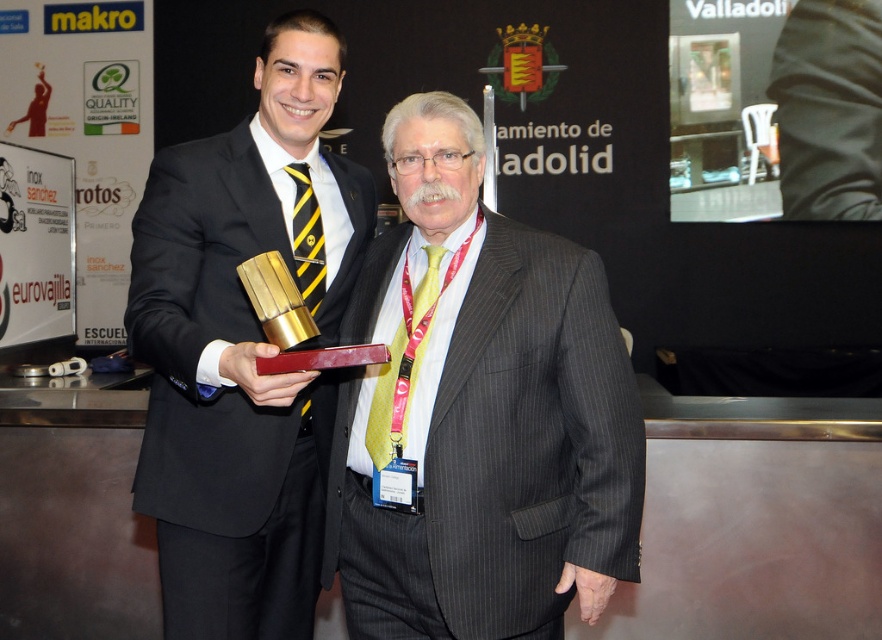
Question: Which is farther from the pinstriped suit at center?

Choices:
 (A) matte black suit at center
 (B) yellowstriped fabrictie at center
 (C) yellow dotted tie at center

Answer: (B)

Question: Which is nearer to the pinstriped suit at center?

Choices:
 (A) matte black suit at center
 (B) yellowstriped fabrictie at center
 (C) yellow dotted tie at center

Answer: (C)

Question: Observing the image, what is the correct spatial positioning of yellow dotted tie at center in reference to yellowstriped fabrictie at center?

Choices:
 (A) above
 (B) below

Answer: (B)

Question: Where is matte black suit at center located in relation to yellowstriped fabrictie at center in the image?

Choices:
 (A) right
 (B) left

Answer: (B)

Question: Is matte black suit at center to the left of yellow dotted tie at center from the viewer's perspective?

Choices:
 (A) yes
 (B) no

Answer: (A)

Question: Which of the following is the closest to the observer?

Choices:
 (A) (395, 426)
 (B) (446, 324)

Answer: (A)